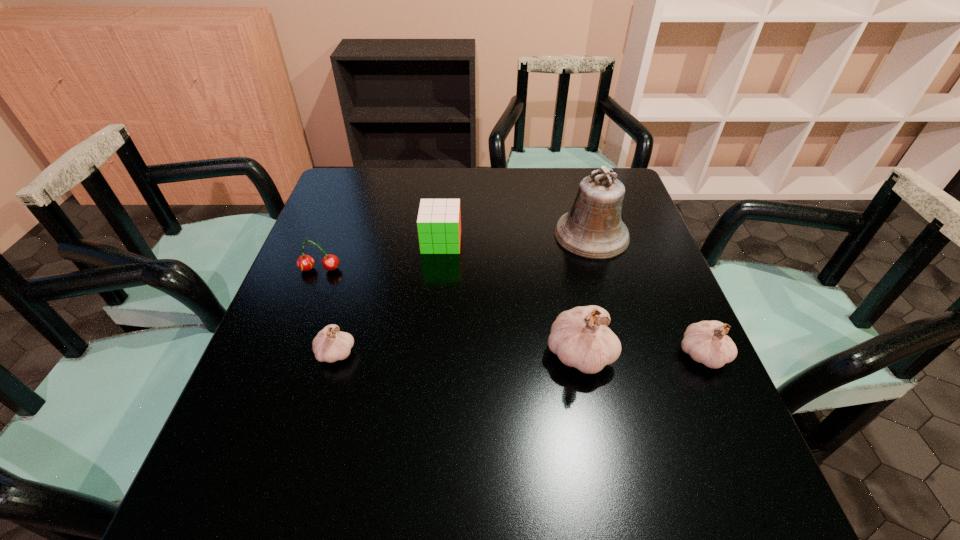
Where is `vacant space located 0.350m on the back of the second object from left to right`? vacant space located 0.350m on the back of the second object from left to right is located at coordinates (370, 235).

Where is `free space located 0.180m on the left of the tallest garlic`? This screenshot has height=540, width=960. free space located 0.180m on the left of the tallest garlic is located at coordinates 460,354.

The height and width of the screenshot is (540, 960). I want to click on free space located 0.370m on the left of the rightmost garlic, so click(502, 355).

The height and width of the screenshot is (540, 960). Identify the location of free space located on the left of the third object from left to right. (378, 241).

Identify the location of free location located 0.250m on the back of the bell. (572, 168).

I want to click on free space located 0.120m with stems pointing upwards on the leftmost object, so click(x=304, y=312).

The height and width of the screenshot is (540, 960). In order to click on garlic that is at the left edge in this screenshot , I will do `click(330, 345)`.

Identify the location of cherry that is at the left edge. (330, 262).

This screenshot has height=540, width=960. I want to click on garlic that is at the right edge, so click(706, 342).

Find the location of a particular element. bell located in the right edge section of the desktop is located at coordinates (593, 229).